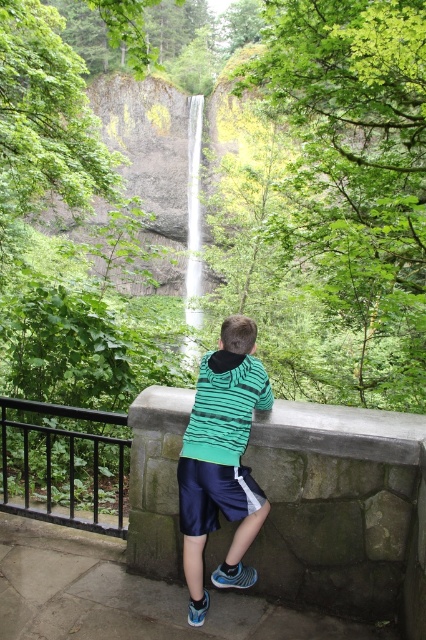
Can you confirm if black metal railing at left is wider than white smooth waterfall at center?

No.

Which is above, black metal railing at left or white smooth waterfall at center?

white smooth waterfall at center is higher up.

Does point (74, 451) come in front of point (189, 339)?

Yes, point (74, 451) is in front of point (189, 339).

Where is `black metal railing at left`? black metal railing at left is located at coordinates (63, 465).

Is green striped hoodie at center to the left of black metal railing at left from the viewer's perspective?

Incorrect, green striped hoodie at center is not on the left side of black metal railing at left.

Based on the photo, who is more forward, (204, 536) or (28, 509)?

Positioned in front is point (204, 536).

At what (x,y) coordinates should I click in order to perform the action: click on green striped hoodie at center. Please return your answer as a coordinate pair (x, y). The height and width of the screenshot is (640, 426). Looking at the image, I should click on (221, 461).

Is green striped hoodie at center thinner than white smooth waterfall at center?

Correct, green striped hoodie at center's width is less than white smooth waterfall at center's.

Can you confirm if green striped hoodie at center is shorter than white smooth waterfall at center?

Yes, green striped hoodie at center is shorter than white smooth waterfall at center.

Which is in front, point (250, 568) or point (187, 356)?

Point (250, 568)

Where is `green striped hoodie at center`? The height and width of the screenshot is (640, 426). green striped hoodie at center is located at coordinates (221, 461).